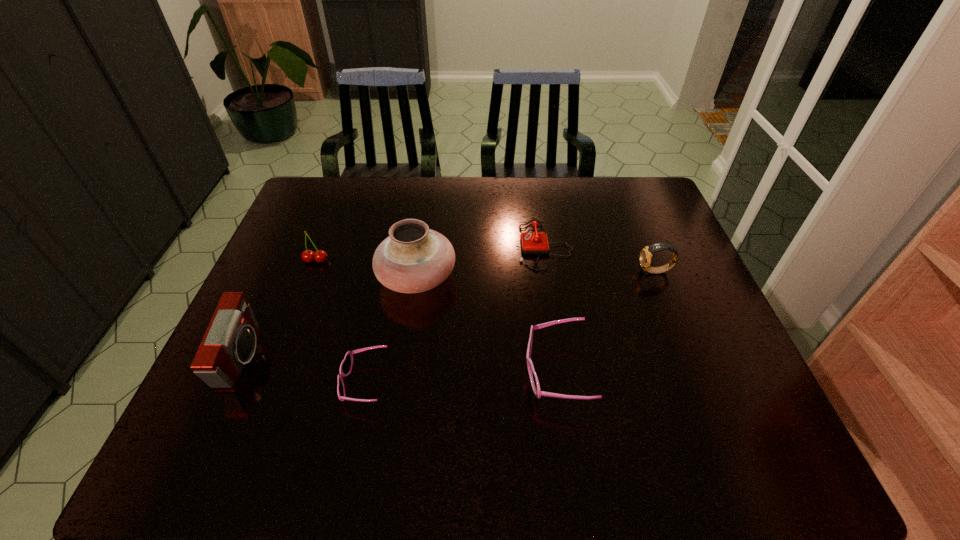
This screenshot has height=540, width=960. In order to click on vacant region located 0.260m on the front-facing side of the left sunglasses in this screenshot , I will do `click(227, 383)`.

You are a GUI agent. You are given a task and a screenshot of the screen. Output one action in this format:
    pyautogui.click(x=<x>, y=<y>)
    Task: Click on the free point located on the front-facing side of the left sunglasses
    This screenshot has width=960, height=540.
    Given the screenshot: What is the action you would take?
    pyautogui.click(x=316, y=383)

The image size is (960, 540). Find the location of `free space located on the front-facing side of the left sunglasses`. free space located on the front-facing side of the left sunglasses is located at coordinates (307, 383).

You are a GUI agent. You are given a task and a screenshot of the screen. Output one action in this format:
    pyautogui.click(x=<x>, y=<y>)
    Task: Click on the free location located on the front-facing side of the right sunglasses
    
    Given the screenshot: What is the action you would take?
    pyautogui.click(x=363, y=373)

This screenshot has height=540, width=960. In order to click on vacant area situated on the front-facing side of the right sunglasses in this screenshot , I will do `click(468, 373)`.

Where is `free spot located on the front-facing side of the right sunglasses`? This screenshot has height=540, width=960. free spot located on the front-facing side of the right sunglasses is located at coordinates pyautogui.click(x=416, y=373).

Find the location of a particular element. free space located on the dial of the sixth tallest object is located at coordinates (434, 245).

This screenshot has height=540, width=960. Find the location of `vacant space situated 0.060m on the dial of the sixth tallest object`. vacant space situated 0.060m on the dial of the sixth tallest object is located at coordinates (497, 245).

At what (x,y) coordinates should I click in order to perform the action: click on vacant space positioned on the dial of the sixth tallest object. Please return your answer as a coordinate pair (x, y). Image resolution: width=960 pixels, height=540 pixels. Looking at the image, I should click on (397, 245).

I want to click on vacant space situated 0.230m on the face of the watch, so click(557, 272).